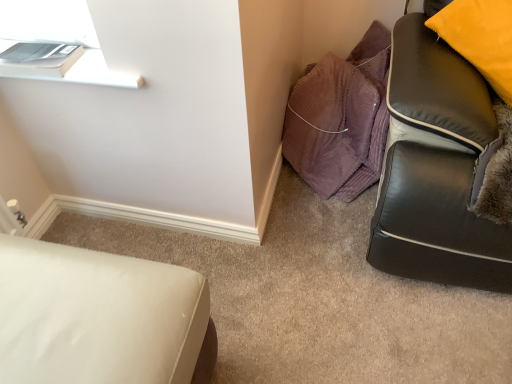
Question: Considering their positions, is white leather ottoman at lower left located in front of or behind purple corduroy pillows at upper right?

Choices:
 (A) front
 (B) behind

Answer: (A)

Question: Looking at their shapes, would you say white leather ottoman at lower left is wider or thinner than purple corduroy pillows at upper right?

Choices:
 (A) thin
 (B) wide

Answer: (B)

Question: From their relative heights in the image, would you say white leather ottoman at lower left is taller or shorter than purple corduroy pillows at upper right?

Choices:
 (A) short
 (B) tall

Answer: (B)

Question: From the image's perspective, is purple corduroy pillows at upper right positioned above or below white leather ottoman at lower left?

Choices:
 (A) above
 (B) below

Answer: (A)

Question: Looking at their shapes, would you say purple corduroy pillows at upper right is wider or thinner than white leather ottoman at lower left?

Choices:
 (A) thin
 (B) wide

Answer: (A)

Question: Is purple corduroy pillows at upper right in front of or behind white leather ottoman at lower left in the image?

Choices:
 (A) behind
 (B) front

Answer: (A)

Question: Is purple corduroy pillows at upper right taller or shorter than white leather ottoman at lower left?

Choices:
 (A) short
 (B) tall

Answer: (A)